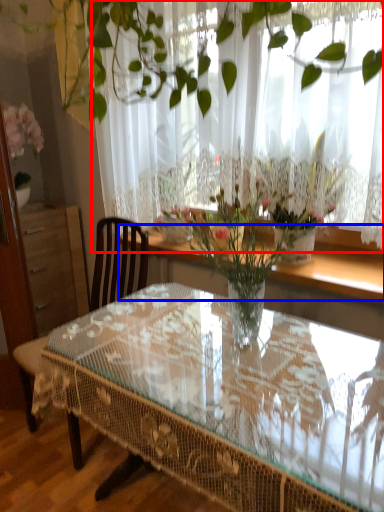
Question: Among these objects, which one is nearest to the camera, curtain (highlighted by a red box) or window sill (highlighted by a blue box)?

Choices:
 (A) curtain
 (B) window sill

Answer: (A)